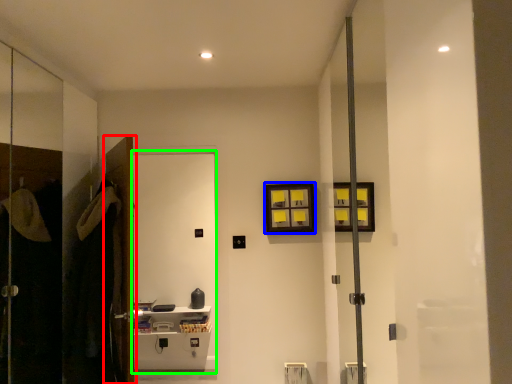
Question: Which object is positioned closest to door (highlighted by a red box)? Select from picture frame (highlighted by a blue box) and screen door (highlighted by a green box).

Choices:
 (A) picture frame
 (B) screen door

Answer: (A)